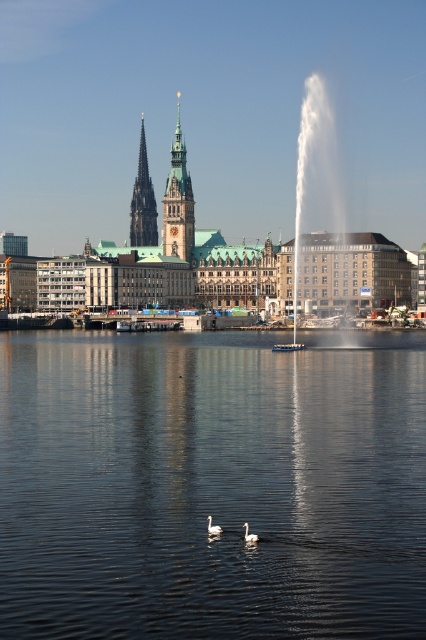
Which is above, transparent water at center or white matte swan at center?

transparent water at center is higher up.

Between transparent water at center and white matte swan at center, which one is positioned lower?

white matte swan at center

Where is `transparent water at center`? This screenshot has height=640, width=426. transparent water at center is located at coordinates (212, 486).

Does transparent water at center appear on the right side of green stone tower at center?

Yes, transparent water at center is to the right of green stone tower at center.

Does transparent water at center have a greater height compared to green stone tower at center?

In fact, transparent water at center may be shorter than green stone tower at center.

Where is `transparent water at center`? transparent water at center is located at coordinates (212, 486).

Does point (183, 225) lie in front of point (154, 241)?

Yes, it is in front of point (154, 241).

Which is in front, point (192, 234) or point (146, 168)?

Point (192, 234) is in front.

The width and height of the screenshot is (426, 640). Identify the location of green stone tower at center. (178, 202).